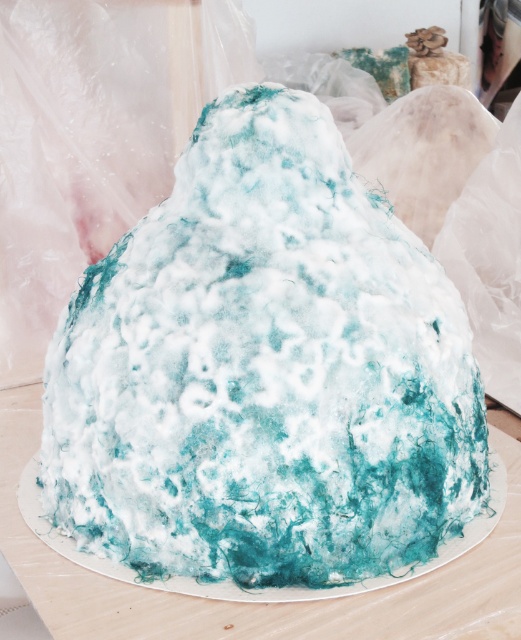
Between turquoise felt cake at center and white textured cake at center, which one appears on the left side from the viewer's perspective?

turquoise felt cake at center is more to the left.

Which of these two, turquoise felt cake at center or white textured cake at center, stands taller?

turquoise felt cake at center

Image resolution: width=521 pixels, height=640 pixels. What do you see at coordinates (265, 371) in the screenshot? I see `turquoise felt cake at center` at bounding box center [265, 371].

At what (x,y) coordinates should I click in order to perform the action: click on turquoise felt cake at center. Please return your answer as a coordinate pair (x, y). This screenshot has width=521, height=640. Looking at the image, I should click on (265, 371).